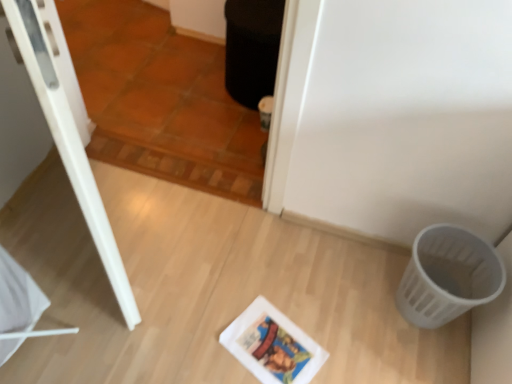
Question: Can you confirm if matte white comic book at center is smaller than brown terracotta tile at upper center?

Choices:
 (A) yes
 (B) no

Answer: (A)

Question: From the image's perspective, is matte white comic book at center below brown terracotta tile at upper center?

Choices:
 (A) no
 (B) yes

Answer: (B)

Question: Does matte white comic book at center turn towards brown terracotta tile at upper center?

Choices:
 (A) yes
 (B) no

Answer: (B)

Question: Can you confirm if matte white comic book at center is taller than brown terracotta tile at upper center?

Choices:
 (A) no
 (B) yes

Answer: (A)

Question: Is matte white comic book at center oriented away from brown terracotta tile at upper center?

Choices:
 (A) no
 (B) yes

Answer: (A)

Question: From a real-world perspective, is matte white comic book at center physically below brown terracotta tile at upper center?

Choices:
 (A) no
 (B) yes

Answer: (B)

Question: From a real-world perspective, is matte white comic book at center positioned under white plastic basket at lower right based on gravity?

Choices:
 (A) no
 (B) yes

Answer: (B)

Question: Does matte white comic book at center have a lesser height compared to white plastic basket at lower right?

Choices:
 (A) no
 (B) yes

Answer: (B)

Question: Can you confirm if matte white comic book at center is positioned to the right of white plastic basket at lower right?

Choices:
 (A) no
 (B) yes

Answer: (A)

Question: Considering the relative positions of matte white comic book at center and white plastic basket at lower right in the image provided, is matte white comic book at center in front of white plastic basket at lower right?

Choices:
 (A) yes
 (B) no

Answer: (B)

Question: From the image's perspective, is matte white comic book at center below white plastic basket at lower right?

Choices:
 (A) no
 (B) yes

Answer: (B)

Question: Is matte white comic book at center bigger than white plastic basket at lower right?

Choices:
 (A) no
 (B) yes

Answer: (A)

Question: From a real-world perspective, is white plastic basket at lower right beneath brown terracotta tile at upper center?

Choices:
 (A) yes
 (B) no

Answer: (A)